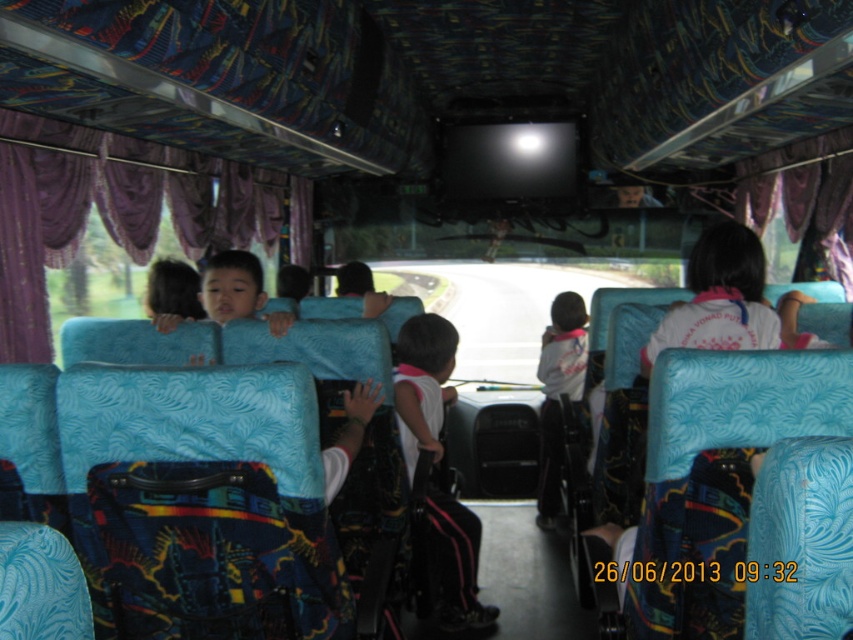
You are a passenger on this bus and want to know if the purple velvet curtain at left is shorter than the white cotton shirt at center. Can you determine this based on their positions?

The purple velvet curtain at left has a lesser height compared to white cotton shirt at center, so yes, the purple velvet curtain at left is shorter than the white cotton shirt at center.

You are sitting on the bus and want to reach an item located at point (454, 330). There is another item at point (218, 243). Which item should you reach for first to avoid obstructing your view?

You should reach for the item at point (218, 243) first because it is closer to you and will not block your view of the item at point (454, 330).

You are a passenger on the bus and want to look out the window. The purple velvet curtain at left and the white matte shirt at center are blocking your view. Which object should you move to get a better view?

You should move the purple velvet curtain at left because it is closer to the viewer than the white matte shirt at center, so moving it would provide a clearer path to the window.